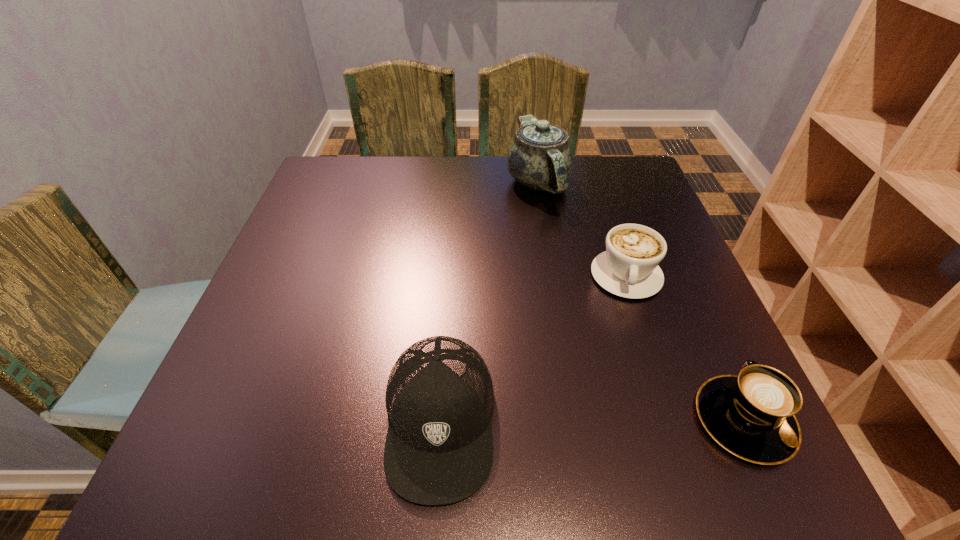
In order to click on vacant space that's between the farther cappuccino and the farthest object in this screenshot , I will do `click(582, 229)`.

Find the location of a particular element. This screenshot has height=540, width=960. vacant area between the tallest object and the cap is located at coordinates (489, 301).

The image size is (960, 540). I want to click on vacant area that lies between the leftmost object and the chinaware, so click(489, 301).

The image size is (960, 540). Identify the location of object that stands as the third closest to the chinaware. (752, 415).

Locate an element on the screen. This screenshot has width=960, height=540. the third closest object to the chinaware is located at coordinates (752, 415).

I want to click on free space that satisfies the following two spatial constraints: 1. on the front side of the farther cappuccino; 2. on the left side of the chinaware, so click(x=554, y=276).

Image resolution: width=960 pixels, height=540 pixels. I want to click on free space that satisfies the following two spatial constraints: 1. on the front side of the farther cappuccino; 2. on the right side of the nearer cappuccino, so click(x=675, y=420).

Identify the location of vacant area in the image that satisfies the following two spatial constraints: 1. on the front side of the chinaware; 2. on the left side of the nearer cappuccino. Image resolution: width=960 pixels, height=540 pixels. (578, 420).